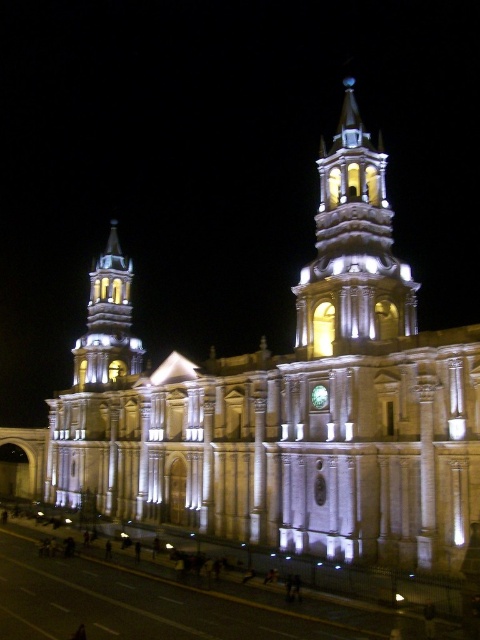
You are standing in front of the cathedral at night. There is a point marked at coordinates [352,248]. What object does this point correspond to?

The point at coordinates [352,248] corresponds to the white stone tower at upper center.

You are standing in front of the cathedral and notice two points of light. One is at point [414,333] and the other at point [134,339]. Which point is closer to you?

Point [414,333] is in front of point [134,339], so it is closer to you.

You are standing in front of the cathedral and want to take a photo of the white stone tower at upper center. According to the coordinates provided, where should you aim your camera to capture it?

You should aim your camera at point 0.389 on the horizontal axis and 0.735 on the vertical axis to capture the white stone tower at upper center.